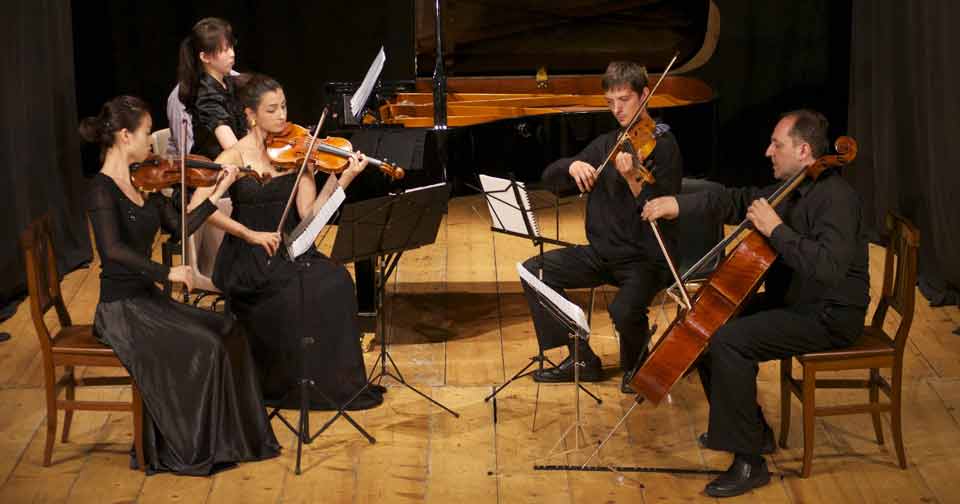
The height and width of the screenshot is (504, 960). Find the location of `piano`. piano is located at coordinates (497, 142).